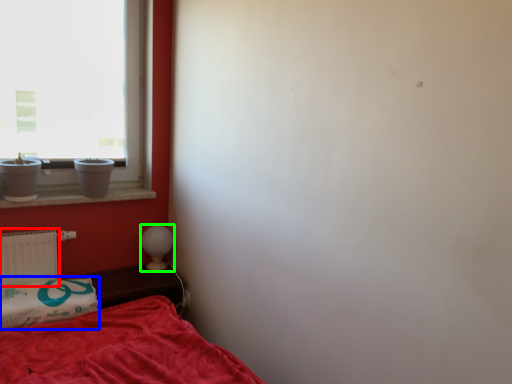
Question: Which object is the farthest from radiator (highlighted by a red box)? Choose among these: pillow (highlighted by a blue box) or table lamp (highlighted by a green box).

Choices:
 (A) pillow
 (B) table lamp

Answer: (B)